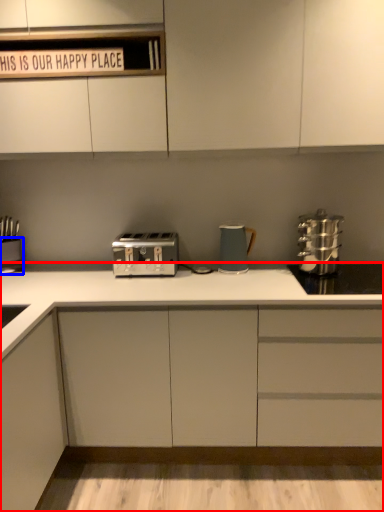
Question: Which point is closer to the camera, cabinetry (highlighted by a red box) or appliance (highlighted by a blue box)?

Choices:
 (A) cabinetry
 (B) appliance

Answer: (A)